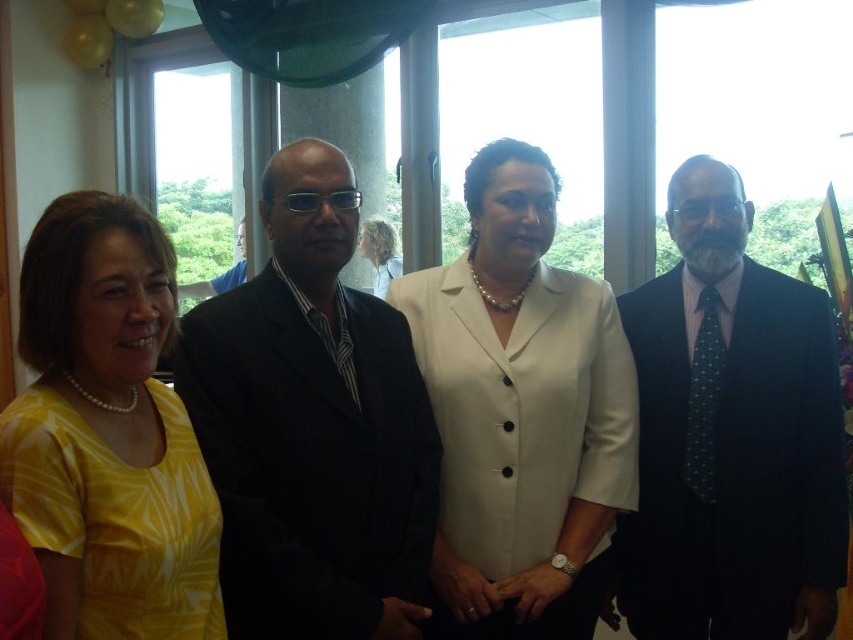
From the picture: Does dark blue suit at right appear over light brown hair at center?

No, dark blue suit at right is not above light brown hair at center.

Is dark blue suit at right behind light brown hair at center?

No.

Is point (711, 499) positioned behind point (395, 266)?

No, (711, 499) is closer to viewer.

Locate an element on the screen. The width and height of the screenshot is (853, 640). dark blue suit at right is located at coordinates (730, 435).

Locate an element on the screen. The height and width of the screenshot is (640, 853). yellow printed blouse at center is located at coordinates (108, 433).

Based on the photo, can you confirm if yellow printed blouse at center is thinner than light brown hair at center?

Incorrect, yellow printed blouse at center's width is not less than light brown hair at center's.

Where is `yellow printed blouse at center`? The height and width of the screenshot is (640, 853). yellow printed blouse at center is located at coordinates (108, 433).

Identify the location of yellow printed blouse at center. The height and width of the screenshot is (640, 853). (108, 433).

Does dark blue suit at right appear under white satin blazer at center?

Yes.

Identify the location of dark blue suit at right. The height and width of the screenshot is (640, 853). (730, 435).

Image resolution: width=853 pixels, height=640 pixels. Find the location of `dark blue suit at right`. dark blue suit at right is located at coordinates coord(730,435).